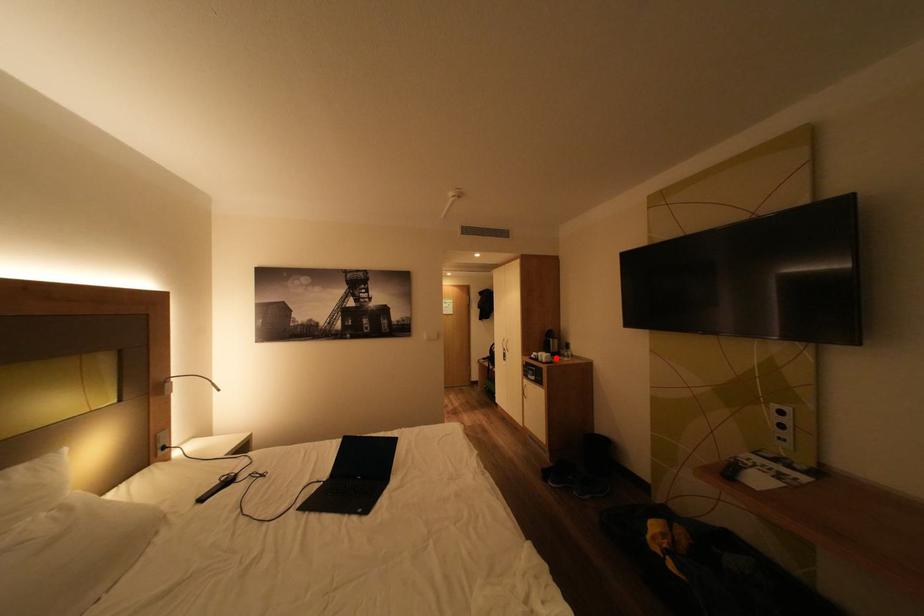
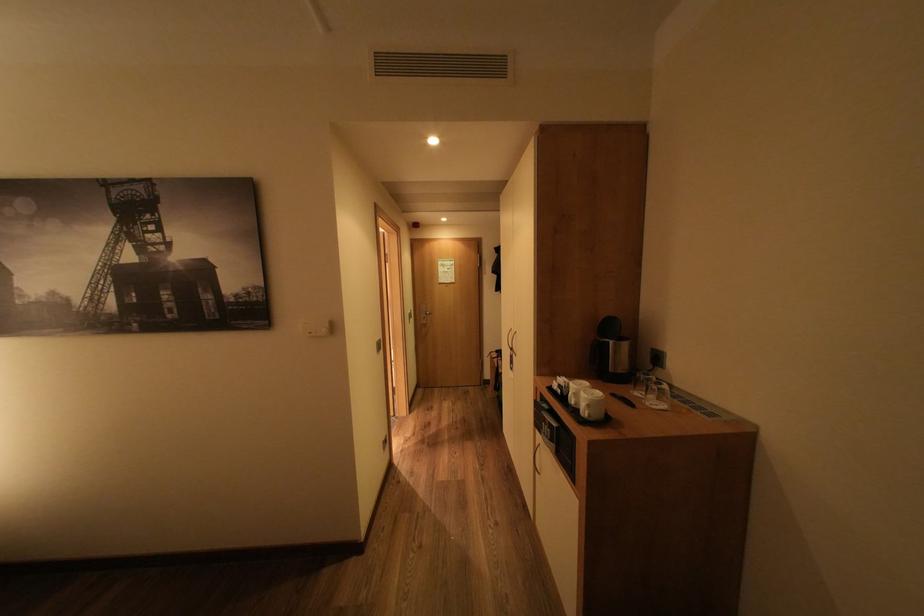
Locate, in the second image, the point that corresponds to the highlighted location in the first image.

(600, 406)